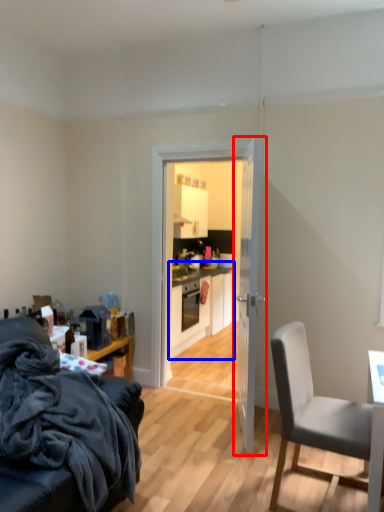
Question: Among these objects, which one is nearest to the camera, door (highlighted by a red box) or cabinetry (highlighted by a blue box)?

Choices:
 (A) door
 (B) cabinetry

Answer: (A)